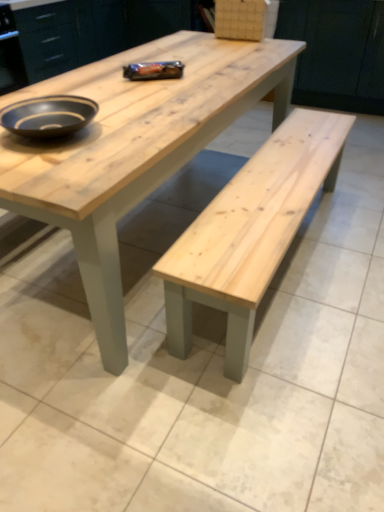
Question: From a real-world perspective, is matte wood cabinet at upper center, which ranks as the second cabinetry in left-to-right order, physically below matte black bowl at upper left?

Choices:
 (A) no
 (B) yes

Answer: (B)

Question: Is matte wood cabinet at upper center, which ranks as the second cabinetry in left-to-right order, completely or partially outside of matte black bowl at upper left?

Choices:
 (A) no
 (B) yes

Answer: (B)

Question: Is matte wood cabinet at upper center, the first cabinetry when ordered from right to left, oriented away from matte black bowl at upper left?

Choices:
 (A) yes
 (B) no

Answer: (B)

Question: Is matte wood cabinet at upper center, the first cabinetry when ordered from right to left, to the left of matte black bowl at upper left from the viewer's perspective?

Choices:
 (A) yes
 (B) no

Answer: (B)

Question: Considering the relative positions of matte wood cabinet at upper center, which ranks as the second cabinetry in left-to-right order, and matte black bowl at upper left in the image provided, is matte wood cabinet at upper center, which ranks as the second cabinetry in left-to-right order, in front of matte black bowl at upper left?

Choices:
 (A) no
 (B) yes

Answer: (A)

Question: Considering the relative sizes of matte wood cabinet at upper center, which ranks as the second cabinetry in left-to-right order, and matte black bowl at upper left in the image provided, is matte wood cabinet at upper center, which ranks as the second cabinetry in left-to-right order, wider than matte black bowl at upper left?

Choices:
 (A) yes
 (B) no

Answer: (A)

Question: Is natural wood cabinet at upper center, which is counted as the second cabinetry, starting from the right, behind matte black bowl at upper left?

Choices:
 (A) no
 (B) yes

Answer: (B)

Question: Is natural wood cabinet at upper center, which is counted as the second cabinetry, starting from the right, looking in the opposite direction of matte black bowl at upper left?

Choices:
 (A) no
 (B) yes

Answer: (A)

Question: Is natural wood cabinet at upper center, marked as the 1th cabinetry in a left-to-right arrangement, far from matte black bowl at upper left?

Choices:
 (A) no
 (B) yes

Answer: (B)

Question: Is the depth of natural wood cabinet at upper center, marked as the 1th cabinetry in a left-to-right arrangement, less than that of matte black bowl at upper left?

Choices:
 (A) yes
 (B) no

Answer: (B)

Question: Can you confirm if natural wood cabinet at upper center, marked as the 1th cabinetry in a left-to-right arrangement, is taller than matte black bowl at upper left?

Choices:
 (A) yes
 (B) no

Answer: (A)

Question: From a real-world perspective, is natural wood cabinet at upper center, which is counted as the second cabinetry, starting from the right, below matte black bowl at upper left?

Choices:
 (A) no
 (B) yes

Answer: (B)

Question: Is natural wood bench at center located within matte black bowl at upper left?

Choices:
 (A) yes
 (B) no

Answer: (B)